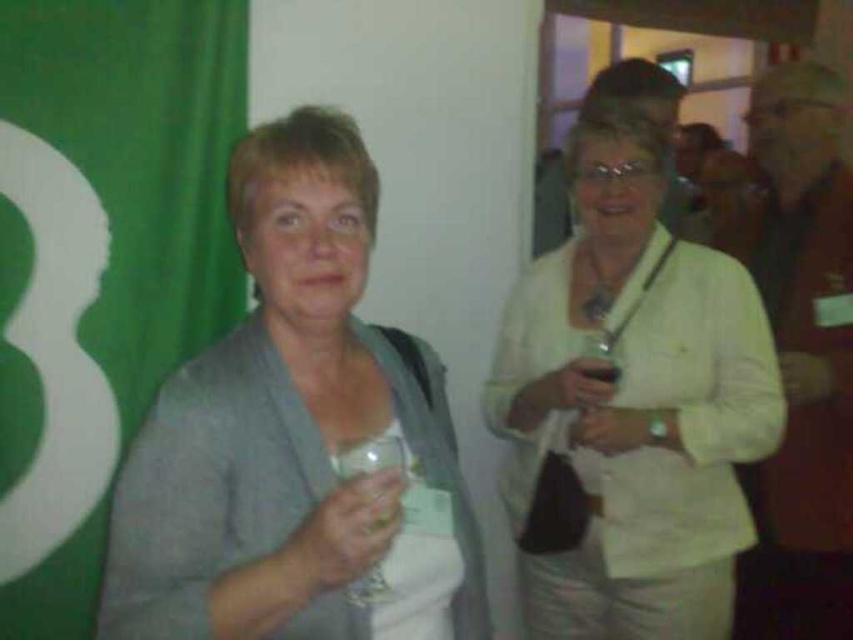
Question: Is gray fabric at center positioned behind transparent plastic glass at center?

Choices:
 (A) yes
 (B) no

Answer: (B)

Question: Which is farther from the clear glass wine glass at center?

Choices:
 (A) white matte jacket at center
 (B) gray fabric at center
 (C) transparent plastic glass at center

Answer: (A)

Question: Can you confirm if white matte jacket at center is positioned below transparent plastic glass at center?

Choices:
 (A) no
 (B) yes

Answer: (B)

Question: Considering the real-world distances, which object is farthest from the transparent plastic glass at center?

Choices:
 (A) gray fabric at center
 (B) clear glass wine glass at center

Answer: (A)

Question: Does clear glass wine glass at center appear on the right side of transparent plastic glass at center?

Choices:
 (A) no
 (B) yes

Answer: (A)

Question: Which of the following is the farthest from the observer?

Choices:
 (A) white matte jacket at center
 (B) clear glass wine glass at center
 (C) gray fabric at center
 (D) transparent plastic glass at center

Answer: (D)